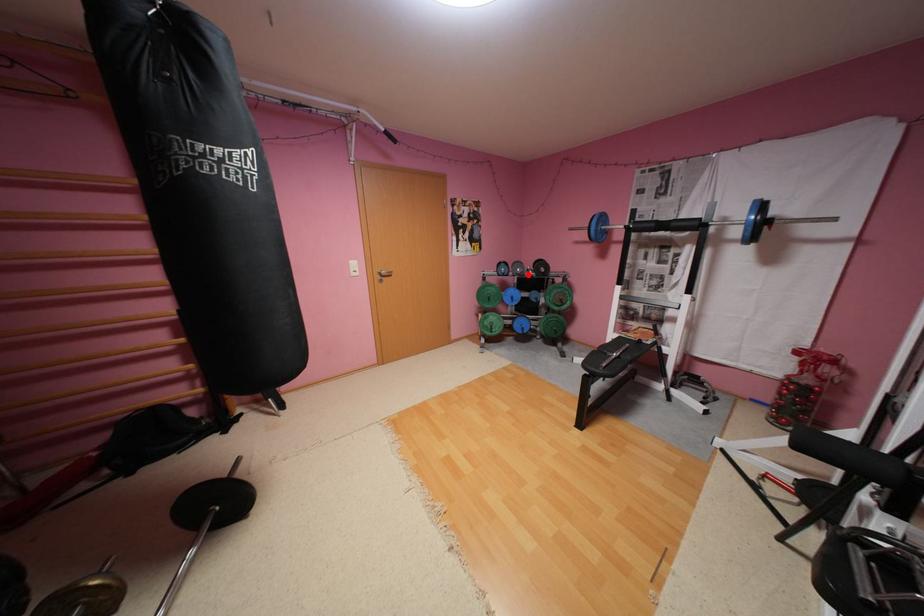
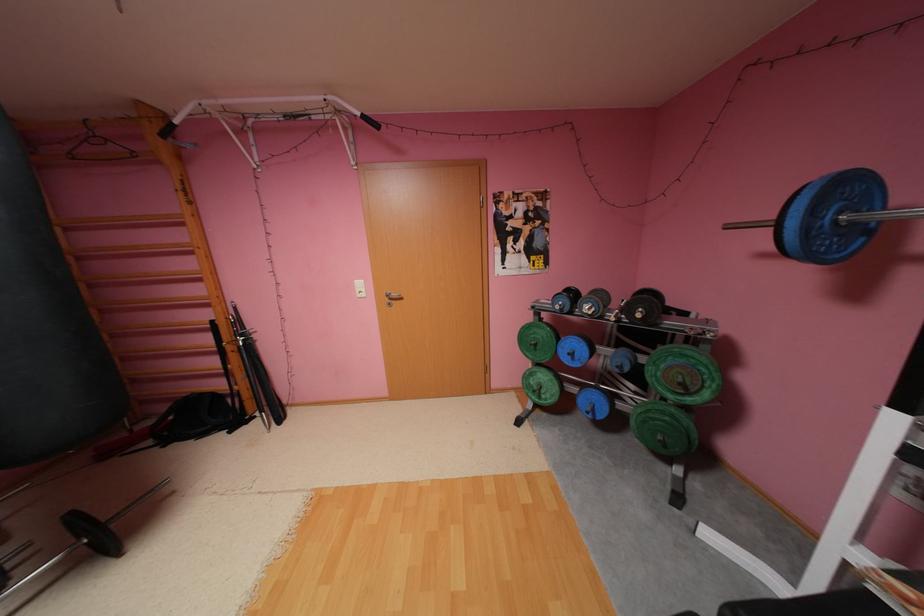
Question: A red point is marked in image1. In image2, is the corresponding 3D point closer to the camera or farther? Reply with the corresponding letter.

Choices:
 (A) The corresponding 3D point is closer.
 (B) The corresponding 3D point is farther.

Answer: (B)